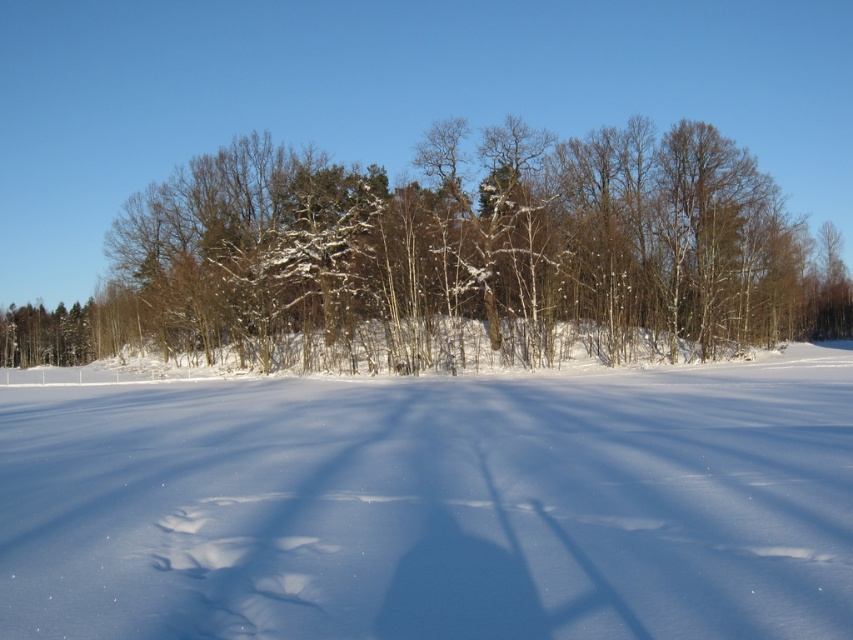
You are standing at the photographer position and see two points in the winter landscape. The first point is at coordinate point [12,628] and the second is at point [735,308]. Which point is closer to you?

Point [12,628] is in front of point [735,308], so it is closer to you.